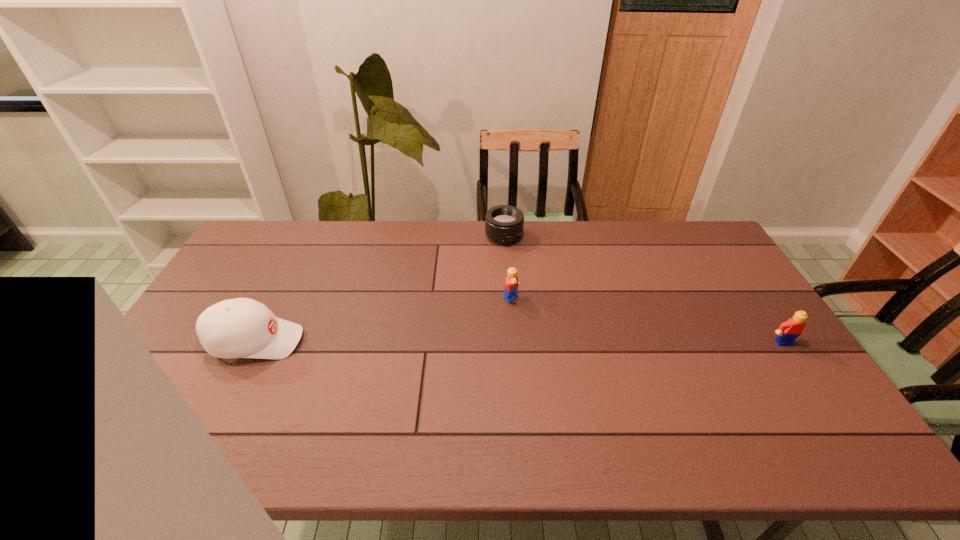
This screenshot has width=960, height=540. I want to click on vacant space on the desktop that is between the baseball cap and the rightmost object and is positioned on the face of the left Lego, so click(576, 342).

Find the location of `vacant space on the desktop that is between the leftmost object and the rightmost object and is positioned on the side of the farthest object with brand markings and control switches`. vacant space on the desktop that is between the leftmost object and the rightmost object and is positioned on the side of the farthest object with brand markings and control switches is located at coordinates (578, 342).